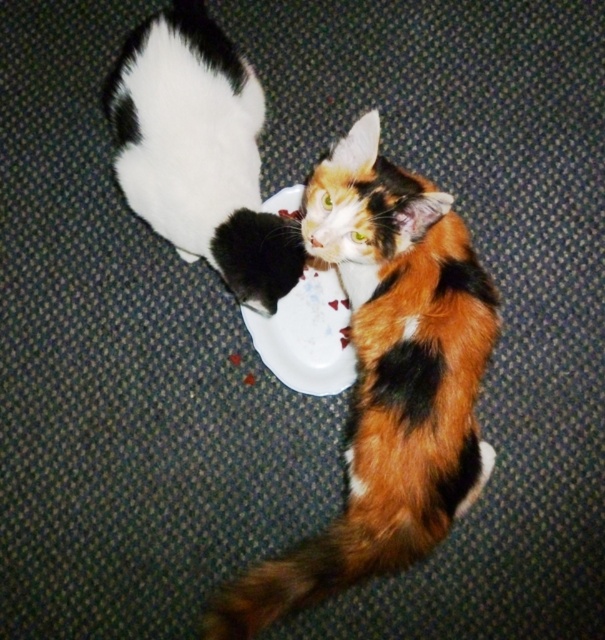
Question: Is white fluffy cat at upper left smaller than white glossy plate at center?

Choices:
 (A) no
 (B) yes

Answer: (A)

Question: Which object appears closest to the camera in this image?

Choices:
 (A) white fluffy cat at upper left
 (B) calico fur cat at center
 (C) white glossy plate at center

Answer: (B)

Question: Which object is farther from the camera taking this photo?

Choices:
 (A) white glossy plate at center
 (B) calico fur cat at center
 (C) white fluffy cat at upper left

Answer: (A)

Question: Is white fluffy cat at upper left to the right of white glossy plate at center from the viewer's perspective?

Choices:
 (A) yes
 (B) no

Answer: (B)

Question: Which point appears farthest from the camera in this image?

Choices:
 (A) (306, 346)
 (B) (186, 246)
 (C) (399, 173)

Answer: (A)

Question: Does calico fur cat at center have a larger size compared to white fluffy cat at upper left?

Choices:
 (A) yes
 (B) no

Answer: (A)